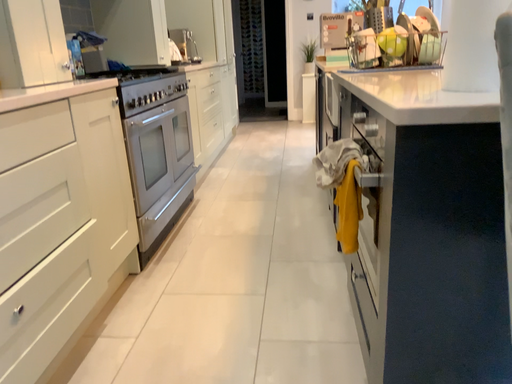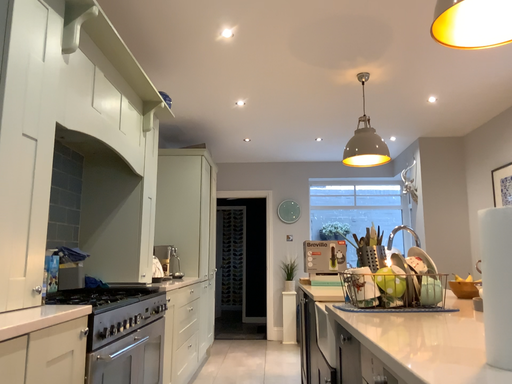
Question: Which way did the camera rotate in the video?

Choices:
 (A) rotated downward
 (B) rotated upward

Answer: (B)